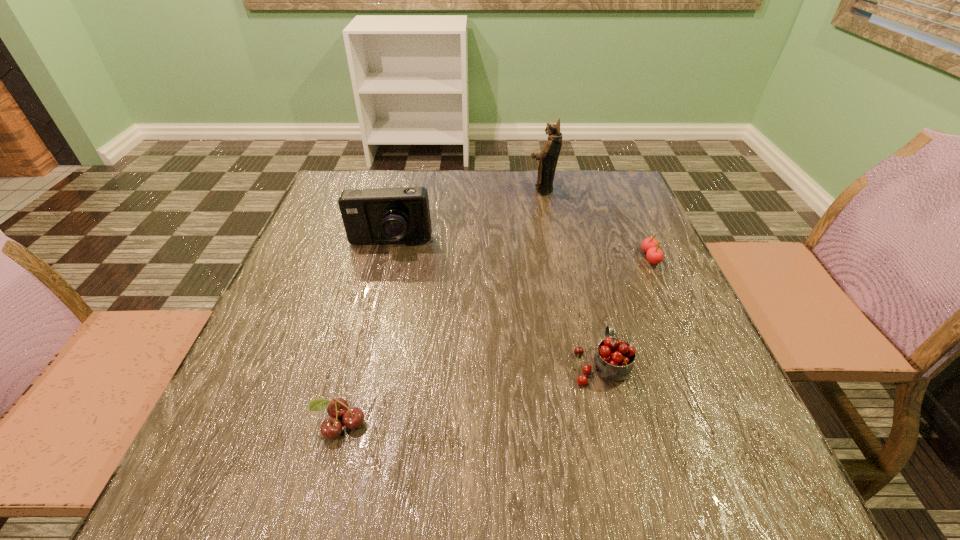
The image size is (960, 540). I want to click on unoccupied position between the camera and the second cherry from left to right, so click(495, 304).

The height and width of the screenshot is (540, 960). Find the location of `free area in between the leftmost cherry and the rightmost object`. free area in between the leftmost cherry and the rightmost object is located at coordinates [x=495, y=341].

Locate an element on the screen. This screenshot has width=960, height=540. free spot between the leftmost cherry and the tallest cherry is located at coordinates pyautogui.click(x=470, y=394).

The height and width of the screenshot is (540, 960). In order to click on free spot between the leftmost cherry and the tallest object in this screenshot , I will do pos(441,307).

Identify the location of vacant space that is in between the nearest object and the camera. (365, 334).

At what (x,y) coordinates should I click in order to perform the action: click on vacant space that's between the farthest object and the nearest cherry. Please return your answer as a coordinate pair (x, y). This screenshot has height=540, width=960. Looking at the image, I should click on (441, 307).

You are a GUI agent. You are given a task and a screenshot of the screen. Output one action in this format:
    pyautogui.click(x=<x>, y=<y>)
    Task: Click on the blank region between the camera and the rightmost cherry
    The width and height of the screenshot is (960, 540).
    Given the screenshot: What is the action you would take?
    pyautogui.click(x=520, y=250)

Identify which object is the nearest to the nearest cherry. Please provide its 2D coordinates. Your answer should be formatted as a tuple, i.e. [(x, y)], where the tuple contains the x and y coordinates of a point satisfying the conditions above.

[(613, 360)]

Where is `the second closest object to the tallest cherry`? The height and width of the screenshot is (540, 960). the second closest object to the tallest cherry is located at coordinates (331, 428).

Identify which cherry is the nearest to the tallest object. Please provide its 2D coordinates. Your answer should be formatted as a tuple, i.e. [(x, y)], where the tuple contains the x and y coordinates of a point satisfying the conditions above.

[(650, 245)]